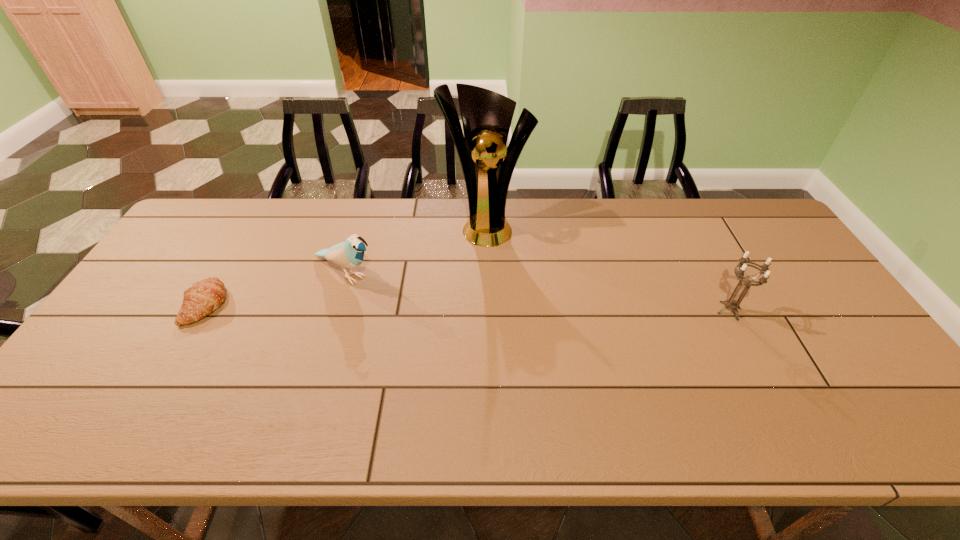
I want to click on object that stands as the third closest to the second object from right to left, so click(x=200, y=300).

Identify which object is located as the nearest to the farthest object. Please provide its 2D coordinates. Your answer should be formatted as a tuple, i.e. [(x, y)], where the tuple contains the x and y coordinates of a point satisfying the conditions above.

[(349, 254)]

The image size is (960, 540). I want to click on blank space that satisfies the following two spatial constraints: 1. on the front side of the candle holder; 2. on the right side of the second object from left to right, so click(335, 310).

Locate an element on the screen. The image size is (960, 540). vacant space that satisfies the following two spatial constraints: 1. on the front side of the candle holder; 2. on the left side of the award is located at coordinates (488, 310).

What are the coordinates of `free location that satisfies the following two spatial constraints: 1. on the back side of the leftmost object; 2. on the right side of the third object from right to left` in the screenshot? It's located at (226, 273).